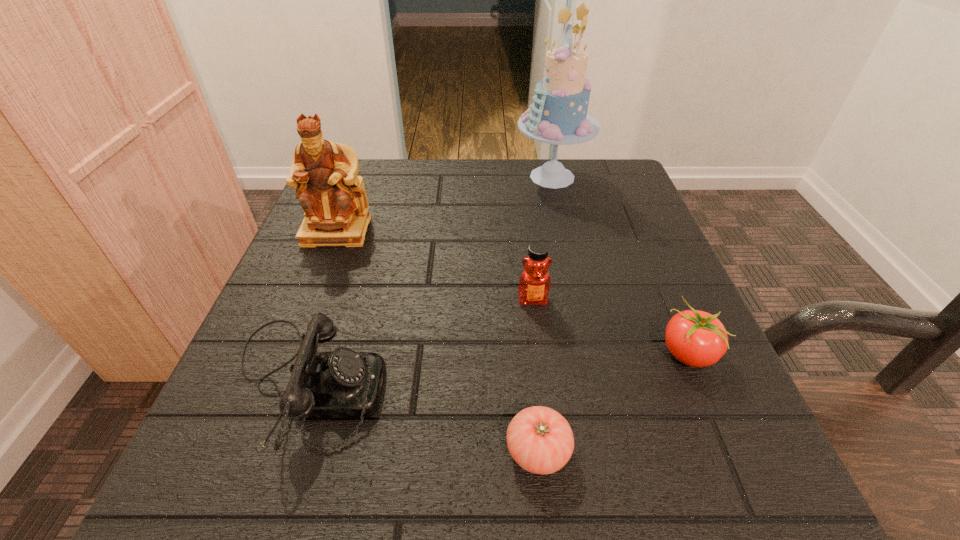
Where is `free location at the left edge of the desktop`? This screenshot has width=960, height=540. free location at the left edge of the desktop is located at coordinates (352, 300).

What are the coordinates of `free spot at the right edge of the desktop` in the screenshot? It's located at (659, 397).

At what (x,y) coordinates should I click in order to perform the action: click on vacant space at the near left corner of the desktop. Please return your answer as a coordinate pair (x, y). The image size is (960, 540). Looking at the image, I should click on (296, 449).

This screenshot has width=960, height=540. In the image, there is a desktop. Identify the location of vacant space at the far right corner. (568, 165).

The image size is (960, 540). Find the location of `free space at the near right corner of the desktop`. free space at the near right corner of the desktop is located at coordinates (677, 472).

The height and width of the screenshot is (540, 960). I want to click on free space between the farthest object and the taller tomato, so click(619, 265).

Find the location of a particular element. The height and width of the screenshot is (540, 960). blank region between the taller tomato and the telephone is located at coordinates (496, 368).

At what (x,y) coordinates should I click in order to perform the action: click on vacant space that's between the third tallest object and the rightmost object. Please return your answer as a coordinate pair (x, y). Looking at the image, I should click on 610,326.

You are a GUI agent. You are given a task and a screenshot of the screen. Output one action in this format:
    pyautogui.click(x=<x>, y=<y>)
    Task: Click on the free spot between the taller tomato and the left tomato
    
    Given the screenshot: What is the action you would take?
    pyautogui.click(x=612, y=402)

Locate an element on the screen. The image size is (960, 540). blank region between the telephone and the taller tomato is located at coordinates (496, 368).